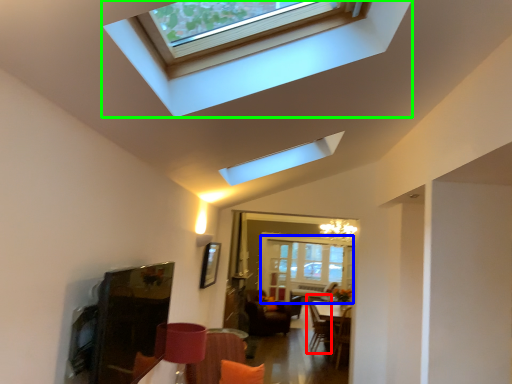
Question: Which is nearer to the swivel chair (highlighted by a red box)? glass door (highlighted by a blue box) or window (highlighted by a green box).

Choices:
 (A) glass door
 (B) window

Answer: (A)